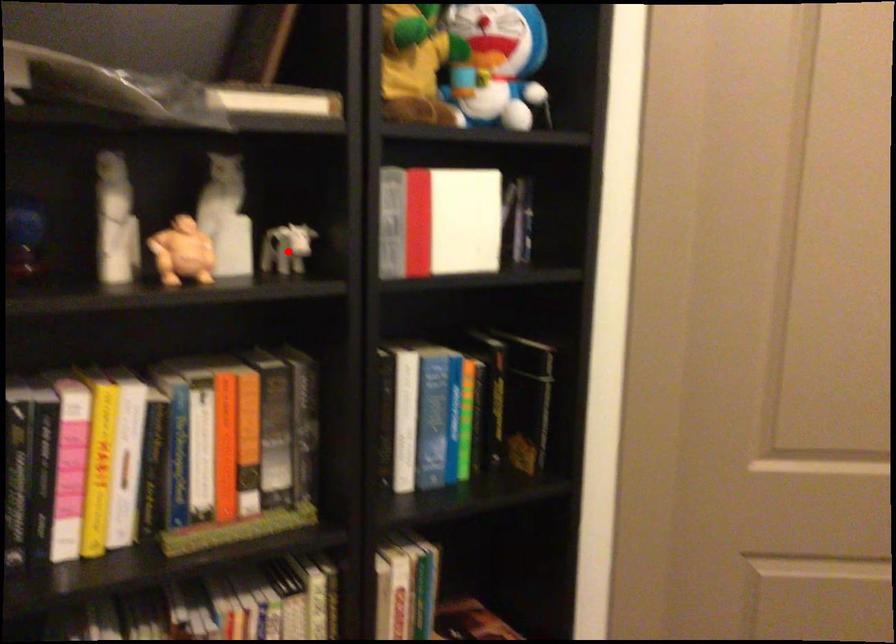
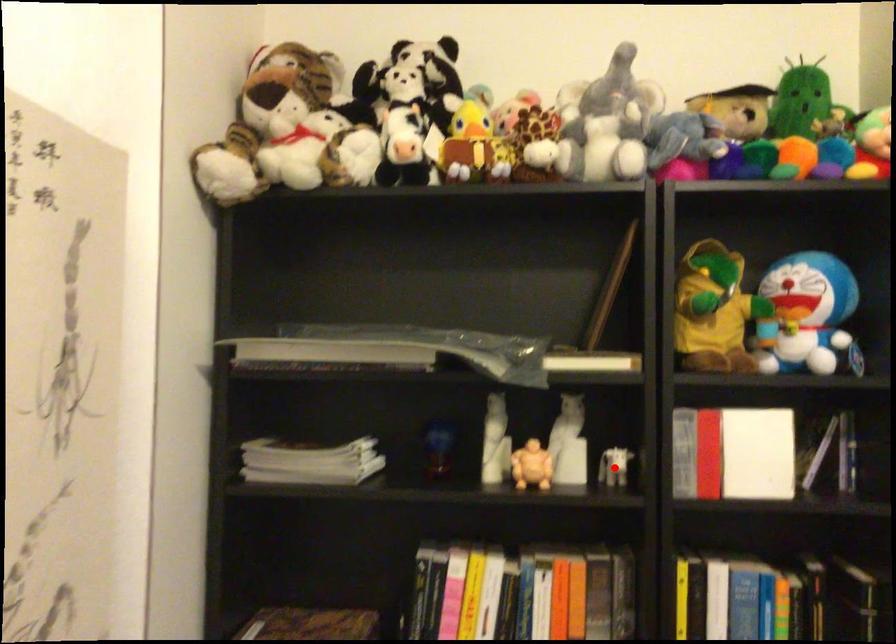
I am providing you with two images of the same scene from different viewpoints. A red point is marked on the first image and another point is marked on the second image. Is the marked point in image1 the same physical position as the marked point in image2?

Yes